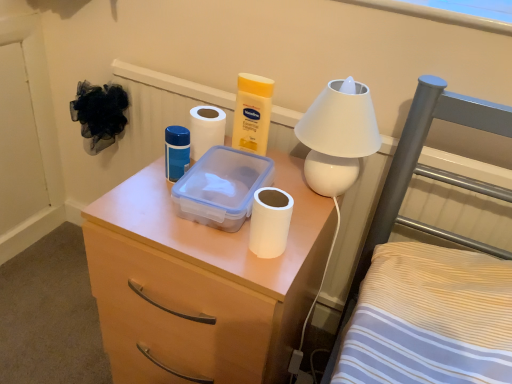
Locate an element on the screen. free space above white matte plastic at center (from a real-world perspective) is located at coordinates (219, 219).